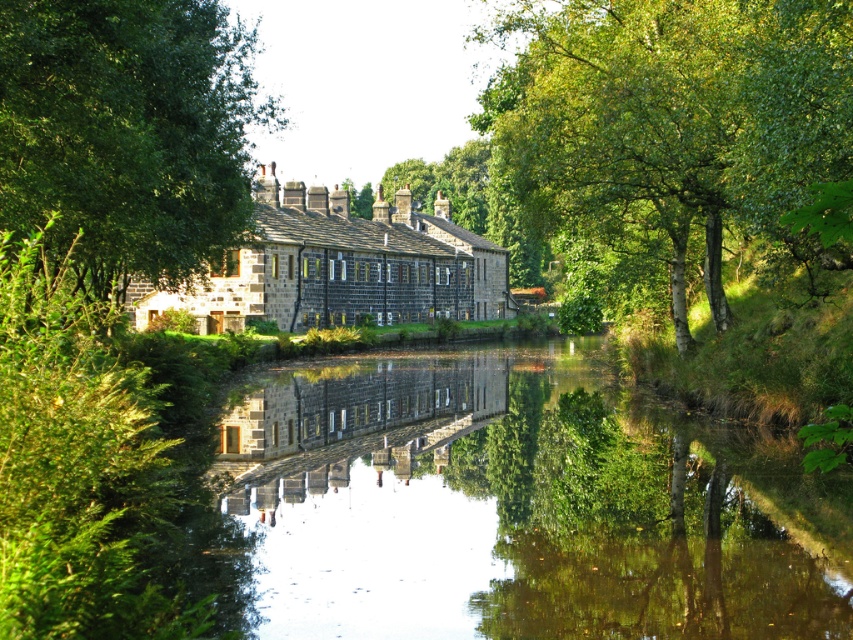
Is green leafy tree at upper center bigger than green leafy tree at upper left?

No.

In the scene shown: Between green leafy tree at upper center and green leafy tree at upper left, which one appears on the left side from the viewer's perspective?

From the viewer's perspective, green leafy tree at upper left appears more on the left side.

Is point (695, 93) farther from viewer compared to point (105, 202)?

Yes, it is.

I want to click on green leafy tree at upper center, so click(x=672, y=115).

Does point (415, 364) come in front of point (84, 285)?

No.

Measure the distance between point [529,387] and camera.

Point [529,387] and camera are 136.09 feet apart.

Who is more forward, (628, 547) or (39, 214)?

Point (628, 547) is in front.

This screenshot has width=853, height=640. Identify the location of smooth reflective water at center. (527, 512).

Between smooth reflective water at center and green leafy tree at upper center, which one appears on the left side from the viewer's perspective?

smooth reflective water at center

The image size is (853, 640). In order to click on smooth reflective water at center in this screenshot , I will do `click(527, 512)`.